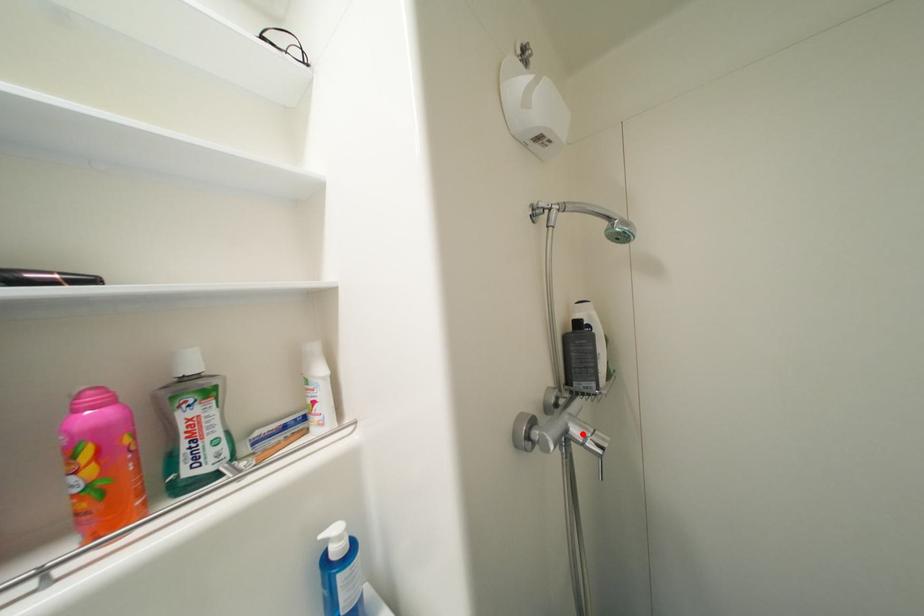
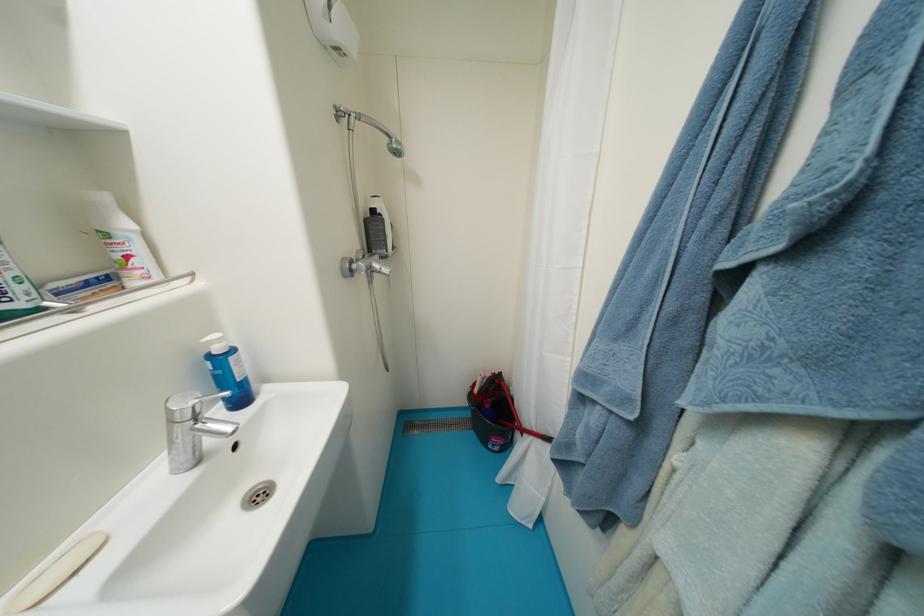
In the second image, find the point that corresponds to the highlighted location in the first image.

(383, 267)